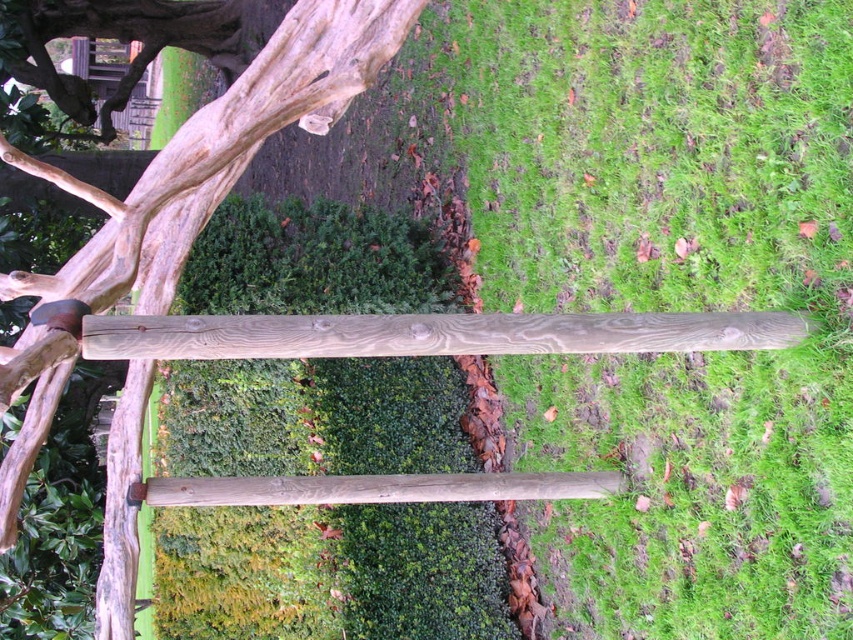
Question: Does green grass at center come behind natural wood tree trunk at upper left?

Choices:
 (A) no
 (B) yes

Answer: (B)

Question: Is green grass at center positioned in front of gray wood rail at center?

Choices:
 (A) no
 (B) yes

Answer: (A)

Question: Which object is closer to the camera taking this photo?

Choices:
 (A) smooth brown wooden rail at center
 (B) gray wood rail at center
 (C) natural wood tree trunk at upper left

Answer: (C)

Question: Estimate the real-world distances between objects in this image. Which object is farther from the green textured hedge at center?

Choices:
 (A) gray wood rail at center
 (B) natural wood tree trunk at upper left

Answer: (A)

Question: Observing the image, what is the correct spatial positioning of green grass at center in reference to gray wood rail at center?

Choices:
 (A) right
 (B) left

Answer: (A)

Question: Estimate the real-world distances between objects in this image. Which object is closer to the smooth brown wooden rail at center?

Choices:
 (A) gray wood rail at center
 (B) green textured hedge at center
 (C) natural wood tree trunk at upper left
 (D) green grass at center

Answer: (C)